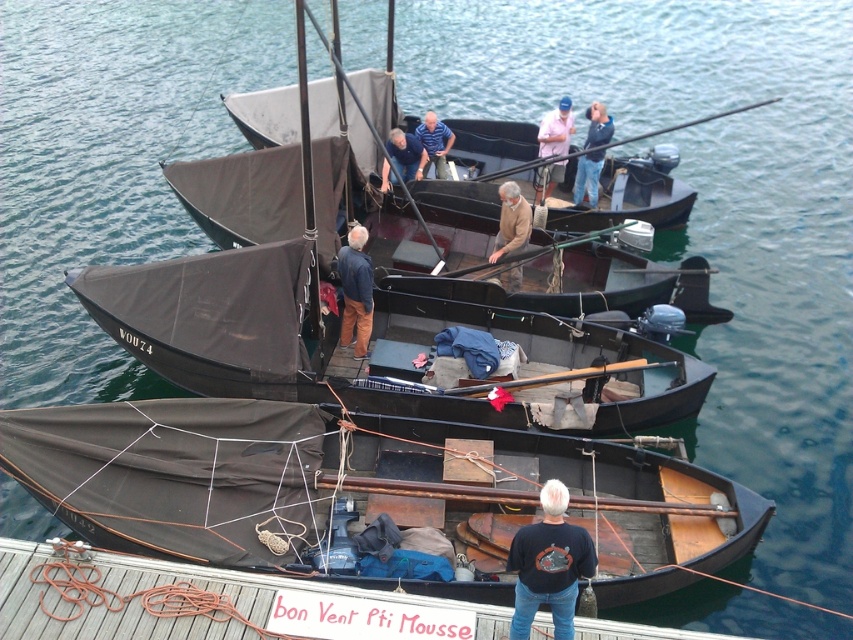
You are a photographer trying to capture a closeup of the blue striped shirt at center while also including the dark brown canvas boat at center in the frame. Given that your camera has a maximum focus range of 3 meters, will you be able to achieve this shot?

The dark brown canvas boat at center and blue striped shirt at center are 3.14 meters apart from each other. Since the distance exceeds the camera maximum focus range of 3 meters, you cannot capture both in the same frame with proper focus.